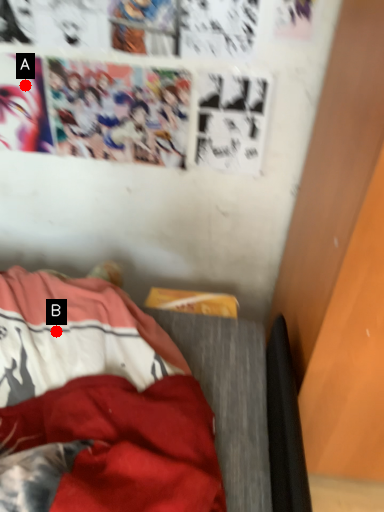
Question: Two points are circled on the image, labeled by A and B beside each circle. Which point is closer to the camera?

Choices:
 (A) A is closer
 (B) B is closer

Answer: (B)